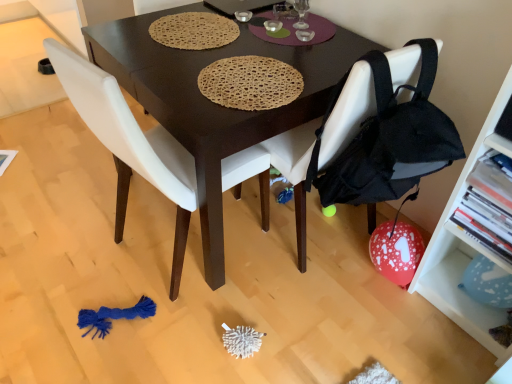
Question: Should I look upward or downward to see dark brown wood desk at center?

Choices:
 (A) up
 (B) down

Answer: (A)

Question: Is white matte chair at center, which ranks as the second chair in right-to-left order, to the left of dark brown wood desk at center from the viewer's perspective?

Choices:
 (A) yes
 (B) no

Answer: (A)

Question: Are white matte chair at center, marked as the 1th chair in a left-to-right arrangement, and dark brown wood desk at center located far from each other?

Choices:
 (A) no
 (B) yes

Answer: (A)

Question: Is white matte chair at center, which ranks as the second chair in right-to-left order, surrounding dark brown wood desk at center?

Choices:
 (A) yes
 (B) no

Answer: (B)

Question: Can you confirm if white matte chair at center, which ranks as the second chair in right-to-left order, is smaller than dark brown wood desk at center?

Choices:
 (A) no
 (B) yes

Answer: (B)

Question: Considering the relative sizes of white matte chair at center, marked as the 1th chair in a left-to-right arrangement, and dark brown wood desk at center in the image provided, is white matte chair at center, marked as the 1th chair in a left-to-right arrangement, wider than dark brown wood desk at center?

Choices:
 (A) no
 (B) yes

Answer: (A)

Question: Can you confirm if white matte chair at center, which ranks as the second chair in right-to-left order, is bigger than dark brown wood desk at center?

Choices:
 (A) no
 (B) yes

Answer: (A)

Question: Does dark brown wood desk at center have a smaller size compared to white matte shelf at right?

Choices:
 (A) no
 (B) yes

Answer: (A)

Question: From the image's perspective, is dark brown wood desk at center above white matte shelf at right?

Choices:
 (A) no
 (B) yes

Answer: (B)

Question: Is dark brown wood desk at center shorter than white matte shelf at right?

Choices:
 (A) yes
 (B) no

Answer: (A)

Question: Are dark brown wood desk at center and white matte shelf at right located far from each other?

Choices:
 (A) no
 (B) yes

Answer: (A)

Question: Could you tell me if dark brown wood desk at center is facing white matte shelf at right?

Choices:
 (A) yes
 (B) no

Answer: (B)

Question: Is dark brown wood desk at center further to camera compared to white matte shelf at right?

Choices:
 (A) no
 (B) yes

Answer: (B)

Question: From the image's perspective, is black fabric chair at lower right, acting as the first chair starting from the right, under white matte chair at center, which ranks as the second chair in right-to-left order?

Choices:
 (A) no
 (B) yes

Answer: (A)